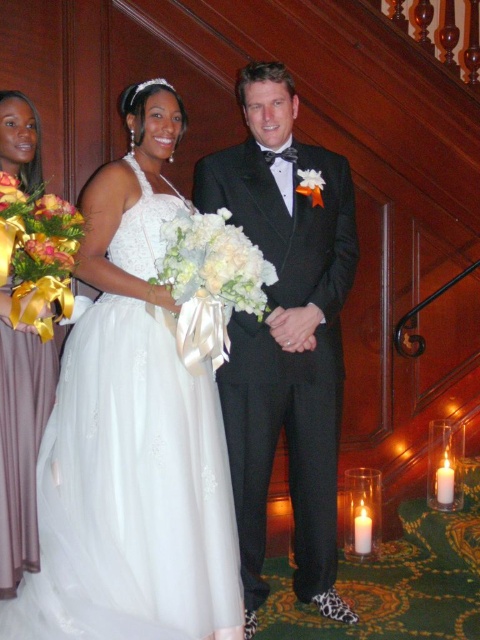
Question: Which point is farther to the camera?

Choices:
 (A) yellow satin ribbon at left
 (B) white silk bouquet at center

Answer: (B)

Question: Is mauve satin dress at left thinner than yellow satin ribbon at left?

Choices:
 (A) no
 (B) yes

Answer: (B)

Question: Is white tulle dress at center further to camera compared to white silk bouquet at center?

Choices:
 (A) yes
 (B) no

Answer: (B)

Question: Which object appears closest to the camera in this image?

Choices:
 (A) white silk bouquet at center
 (B) black satin tuxedo at center
 (C) yellow satin ribbon at left

Answer: (C)

Question: Does black satin tuxedo at center have a greater width compared to white silk bouquet at center?

Choices:
 (A) no
 (B) yes

Answer: (B)

Question: Which of the following is the farthest from the observer?

Choices:
 (A) (257, 305)
 (B) (33, 452)
 (C) (8, 276)
 (D) (172, 202)

Answer: (D)